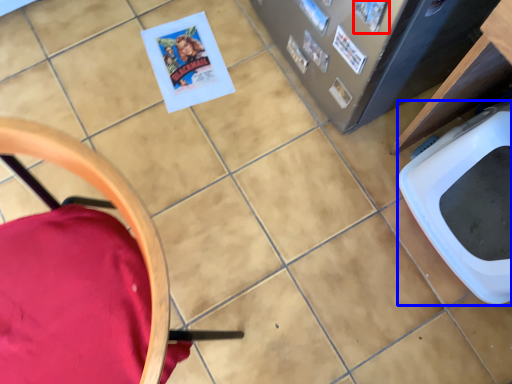
Question: Which object is further to the camera taking this photo, comic book (highlighted by a red box) or toilet bowl (highlighted by a blue box)?

Choices:
 (A) comic book
 (B) toilet bowl

Answer: (A)